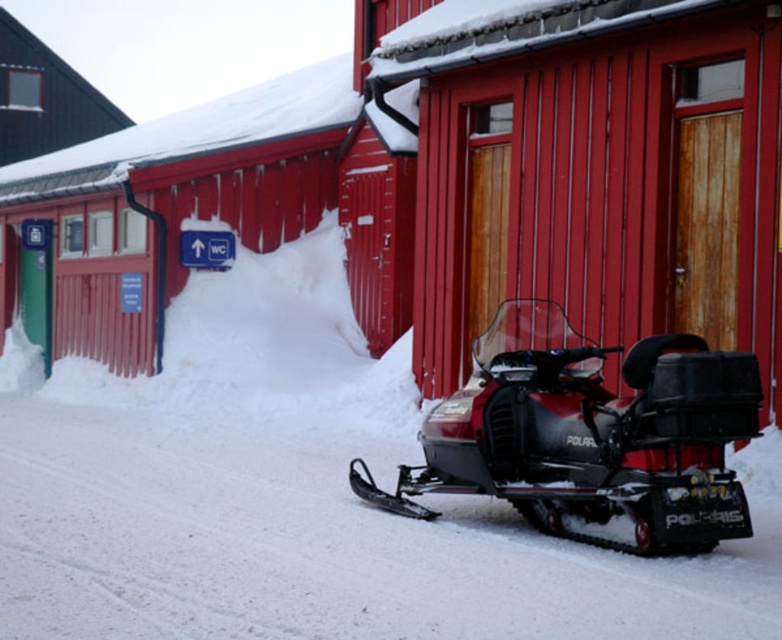
Between point (604, 38) and point (562, 438), which one is positioned in front?

Positioned in front is point (562, 438).

Is point (770, 97) positioned before point (587, 493)?

No.

Find the location of `smooth wood door at center`. smooth wood door at center is located at coordinates (590, 168).